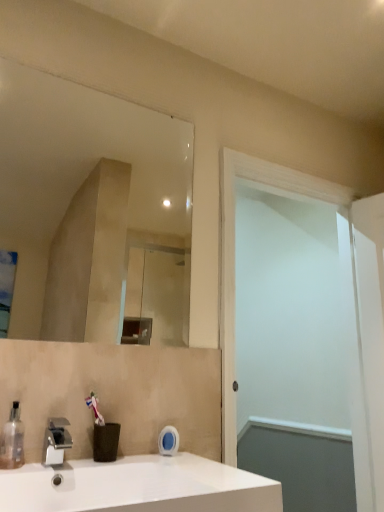
Question: Could you tell me if silver metallic faucet at lower left is facing white matte screen door at right?

Choices:
 (A) no
 (B) yes

Answer: (A)

Question: Is silver metallic faucet at lower left with white matte screen door at right?

Choices:
 (A) no
 (B) yes

Answer: (A)

Question: Is silver metallic faucet at lower left not near white matte screen door at right?

Choices:
 (A) no
 (B) yes

Answer: (A)

Question: Is silver metallic faucet at lower left bigger than white matte screen door at right?

Choices:
 (A) yes
 (B) no

Answer: (B)

Question: Is silver metallic faucet at lower left further to camera compared to white matte screen door at right?

Choices:
 (A) yes
 (B) no

Answer: (B)

Question: Does point (14, 453) appear closer or farther from the camera than point (66, 446)?

Choices:
 (A) farther
 (B) closer

Answer: (B)

Question: Is transparent plastic soap dispenser at lower left situated inside silver metallic faucet at lower left or outside?

Choices:
 (A) inside
 (B) outside

Answer: (B)

Question: Is transparent plastic soap dispenser at lower left wider or thinner than silver metallic faucet at lower left?

Choices:
 (A) thin
 (B) wide

Answer: (A)

Question: Is transparent plastic soap dispenser at lower left bigger or smaller than silver metallic faucet at lower left?

Choices:
 (A) big
 (B) small

Answer: (B)

Question: Is white glossy sink at lower left taller or shorter than transparent plastic soap dispenser at lower left?

Choices:
 (A) tall
 (B) short

Answer: (A)

Question: In the image, is white glossy sink at lower left positioned in front of or behind transparent plastic soap dispenser at lower left?

Choices:
 (A) front
 (B) behind

Answer: (A)

Question: Is white glossy sink at lower left spatially inside transparent plastic soap dispenser at lower left, or outside of it?

Choices:
 (A) inside
 (B) outside

Answer: (B)

Question: Based on their sizes in the image, would you say white glossy sink at lower left is bigger or smaller than transparent plastic soap dispenser at lower left?

Choices:
 (A) small
 (B) big

Answer: (B)

Question: Is point (0, 455) closer or farther from the camera than point (223, 468)?

Choices:
 (A) closer
 (B) farther

Answer: (B)

Question: Relative to white glossy sink at lower left, is transparent plastic soap dispenser at lower left in front or behind?

Choices:
 (A) behind
 (B) front

Answer: (A)